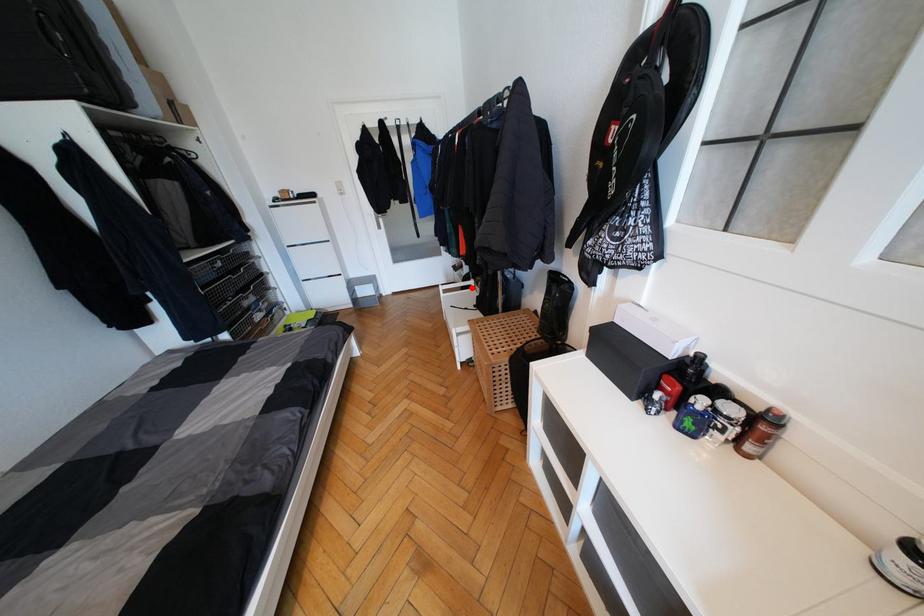
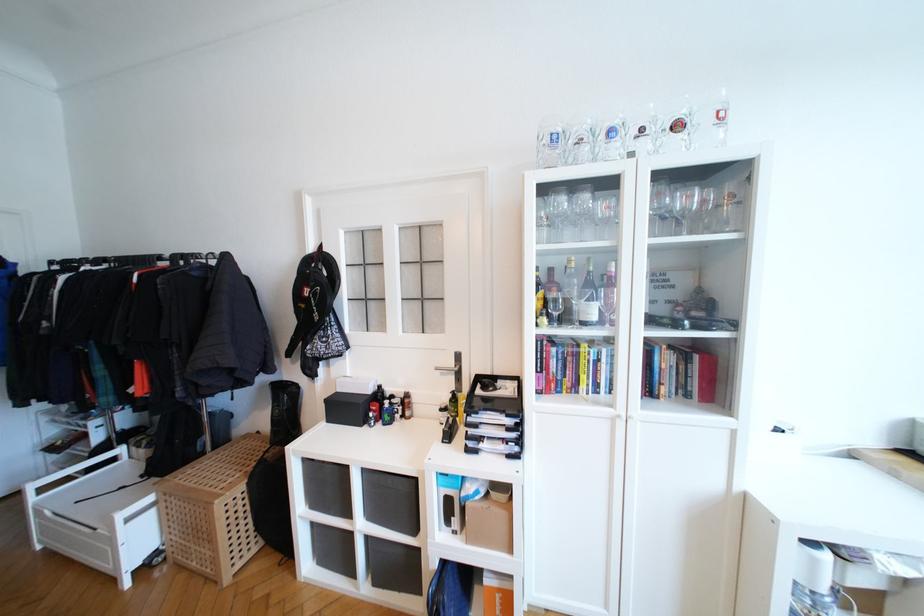
Question: I am providing you with two images of the same scene from different viewpoints. Given a red point in image1, look at the same physical point in image2. Is it:

Choices:
 (A) Closer to the viewpoint
 (B) Farther from the viewpoint

Answer: (B)